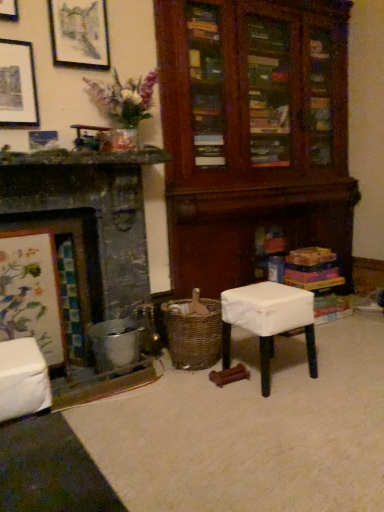
The image size is (384, 512). What are the coordinates of `free region under white fabric-covered stool at center (from a real-world perspective)` in the screenshot? It's located at (269, 374).